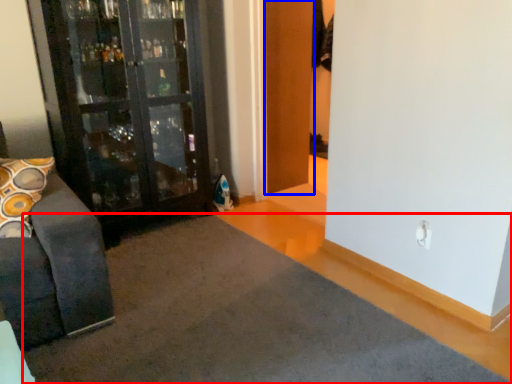
Question: Which object is further to the camera taking this photo, doormat (highlighted by a red box) or door (highlighted by a blue box)?

Choices:
 (A) doormat
 (B) door

Answer: (B)